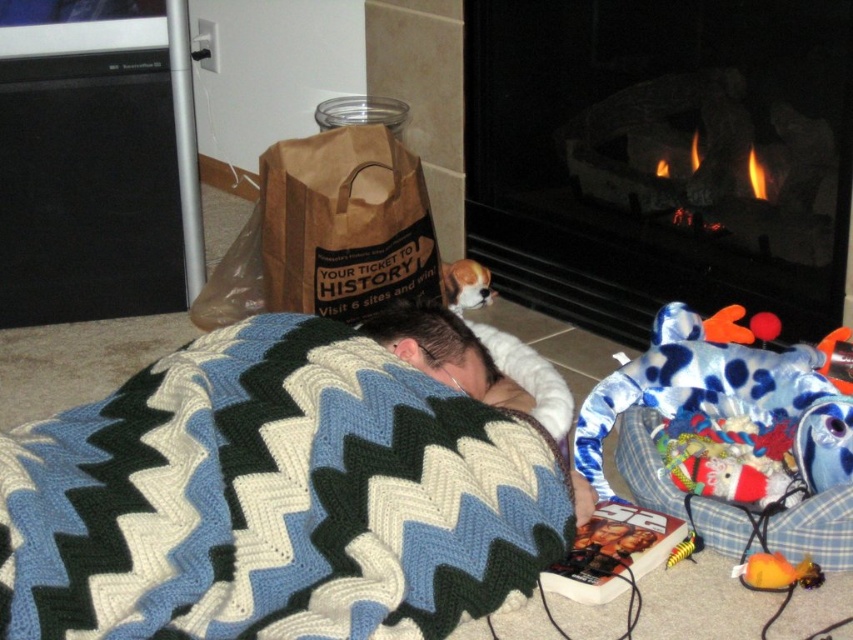
Question: Which of the following is the farthest from the observer?

Choices:
 (A) (71, 515)
 (B) (469, 259)

Answer: (B)

Question: Which point is farther to the camera?

Choices:
 (A) (299, 228)
 (B) (35, 624)

Answer: (A)

Question: Can you confirm if woolen zigzag blanket at center is positioned to the right of smooth stone fireplace at center?

Choices:
 (A) no
 (B) yes

Answer: (A)

Question: Which of the following is the farthest from the observer?

Choices:
 (A) (740, 269)
 (B) (154, 570)

Answer: (A)

Question: Where is smooth stone fireplace at center located in relation to knitted wool blanket at center in the image?

Choices:
 (A) below
 (B) above

Answer: (B)

Question: Can you confirm if woolen zigzag blanket at center is positioned below smooth stone fireplace at center?

Choices:
 (A) no
 (B) yes

Answer: (B)